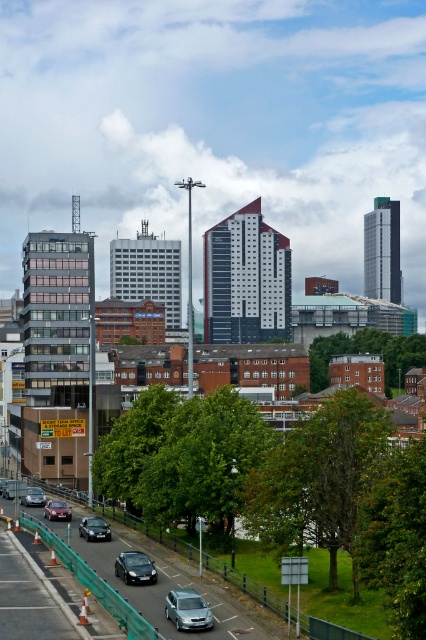
You are a delivery driver who needs to park your shiny silver car at center in a parking spot that can only accommodate vehicles narrower than the satin silver car at lower center. Is your car too wide for the spot?

The satin silver car at lower center is narrower than the shiny silver car at center. Since the parking spot requires vehicles narrower than the satin silver car, the shiny silver car at center is too wide and cannot fit into the parking spot.